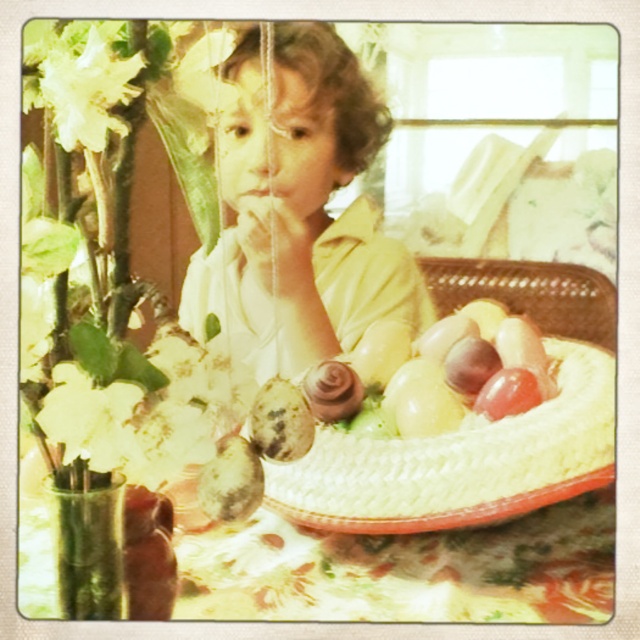
Who is positioned more to the left, matte yellow shirt at center or white matte flower at upper left?

white matte flower at upper left is more to the left.

Is matte yellow shirt at center positioned in front of white matte flower at upper left?

That is False.

Describe the element at coordinates (298, 208) in the screenshot. I see `matte yellow shirt at center` at that location.

Where is `matte yellow shirt at center`? The height and width of the screenshot is (640, 640). matte yellow shirt at center is located at coordinates click(298, 208).

Can you confirm if white matte flower at upper left is positioned to the right of white matte flower at left?

In fact, white matte flower at upper left is to the left of white matte flower at left.

Between white matte flower at upper left and white matte flower at left, which one is positioned lower?

white matte flower at left is lower down.

Where is `white matte flower at upper left`? white matte flower at upper left is located at coordinates (81, 83).

You are a GUI agent. You are given a task and a screenshot of the screen. Output one action in this format:
    pyautogui.click(x=<x>, y=<y>)
    Task: Click on the white matte flower at upper left
    This screenshot has width=640, height=640.
    Given the screenshot: What is the action you would take?
    pyautogui.click(x=81, y=83)

Does matte yellow shirt at center have a greater width compared to white matte flower at left?

Indeed, matte yellow shirt at center has a greater width compared to white matte flower at left.

Can you confirm if matte yellow shirt at center is shorter than white matte flower at left?

No, matte yellow shirt at center is not shorter than white matte flower at left.

You are a GUI agent. You are given a task and a screenshot of the screen. Output one action in this format:
    pyautogui.click(x=<x>, y=<y>)
    Task: Click on the matte yellow shirt at center
    This screenshot has height=640, width=640.
    Given the screenshot: What is the action you would take?
    pyautogui.click(x=298, y=208)

This screenshot has width=640, height=640. Identify the location of matte yellow shirt at center. (298, 208).